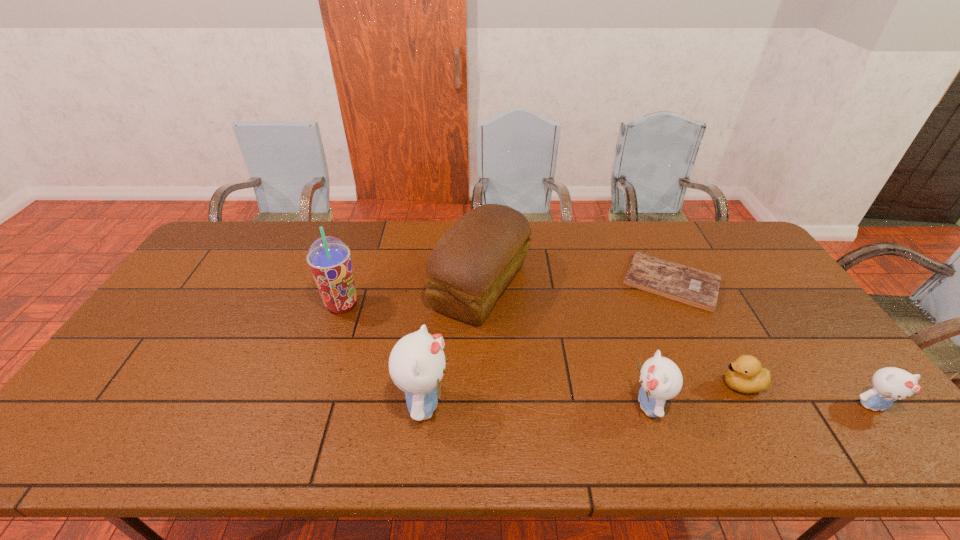
At what (x,y) coordinates should I click in order to perform the action: click on the leftmost kitten. Please return your answer as a coordinate pair (x, y). Image resolution: width=960 pixels, height=540 pixels. Looking at the image, I should click on (417, 362).

The image size is (960, 540). Find the location of `the fourth tallest object`. the fourth tallest object is located at coordinates (661, 379).

The width and height of the screenshot is (960, 540). Find the location of `the second shortest kitten`. the second shortest kitten is located at coordinates (661, 379).

This screenshot has height=540, width=960. Identify the location of the rightmost kitten. (889, 384).

Locate an element on the screen. the rightmost object is located at coordinates (889, 384).

Find the location of `Bible`. Bible is located at coordinates (691, 286).

What are the coordinates of `the leftmost object` in the screenshot? It's located at (329, 258).

Where is `the tallest object`? This screenshot has width=960, height=540. the tallest object is located at coordinates (329, 258).

This screenshot has height=540, width=960. In order to click on bread in this screenshot , I will do `click(472, 263)`.

Locate an element on the screen. the second shortest object is located at coordinates (745, 375).